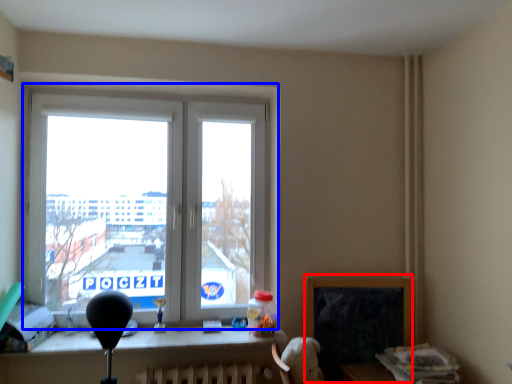
Question: Which point is closer to the camera, window screen (highlighted by a red box) or window (highlighted by a blue box)?

Choices:
 (A) window screen
 (B) window

Answer: (B)